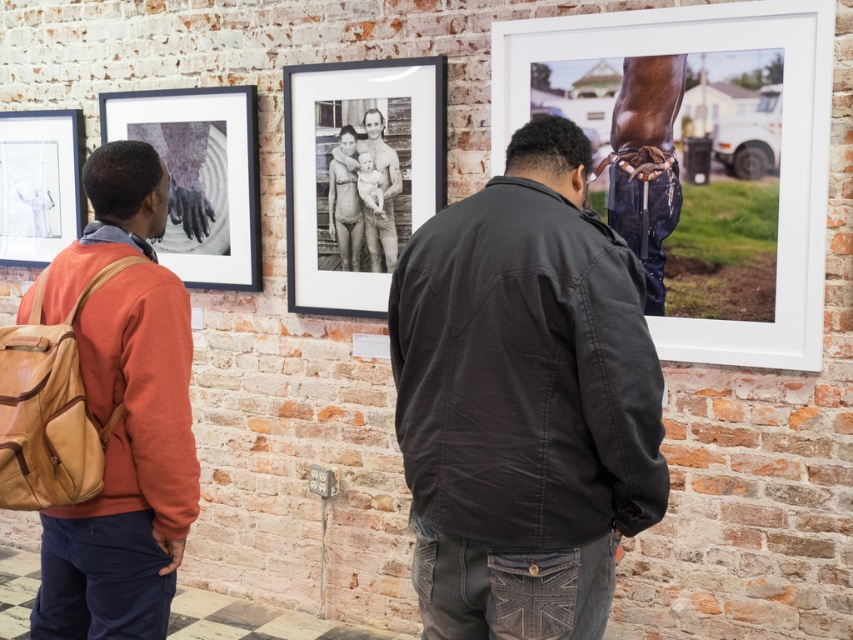
Is point (537, 180) positioned in front of point (149, 122)?

Yes, it is.

Between dark gray jacket at center and matte black frame at upper left, which one is positioned higher?

matte black frame at upper left

Locate an element on the screen. This screenshot has width=853, height=640. dark gray jacket at center is located at coordinates (523, 401).

Can you confirm if dark gray jacket at center is taller than white matte picture frame at right?

Incorrect, dark gray jacket at center's height is not larger of white matte picture frame at right's.

Image resolution: width=853 pixels, height=640 pixels. In order to click on dark gray jacket at center in this screenshot , I will do `click(523, 401)`.

Measure the distance between point (527,172) and camera.

The distance of point (527,172) from camera is 7.03 feet.

Locate an element on the screen. This screenshot has width=853, height=640. dark gray jacket at center is located at coordinates click(523, 401).

Can you confirm if orange sweater at left is positioned to the right of matte black frame at upper left?

Yes, orange sweater at left is to the right of matte black frame at upper left.

Between point (157, 500) and point (209, 156), which one is positioned behind?

Positioned behind is point (209, 156).

This screenshot has height=640, width=853. What are the coordinates of `orange sweater at left` in the screenshot? It's located at (123, 413).